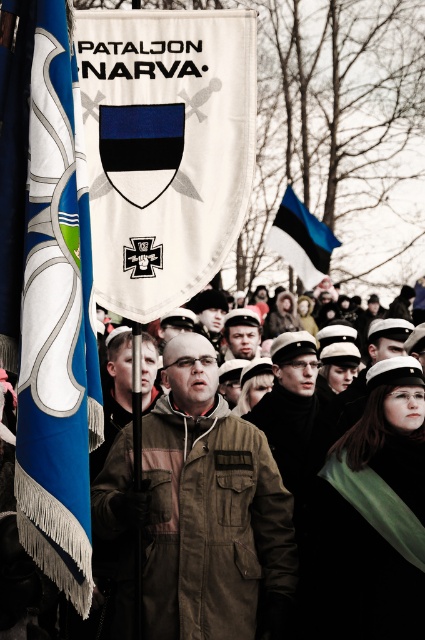
You are standing at the event and want to take a photo of the point at coordinates point (147, 253). If your camera has a maximum focus range of 25 meters, will you be able to focus on it?

The point (147, 253) is 27.66 meters from the viewer, which exceeds the camera maximum focus range of 25 meters. So you won not be able to focus on it.

You are standing at the edge of the crowd watching the ceremony. You need to locate the person holding the flagpole with the banner. Which direction should you look relative to the point marked at coordinates point (201, 509)?

The point (201, 509) corresponds to the brown suede jacket at center, so you should look towards the center to find the person holding the flagpole with the banner.

From the picture: You are a photographer trying to capture a clear photo of the brown suede jacket at center and the blue fringed flag at left. Which object should you focus on first if you want to ensure both are in focus without adjusting your camera settings?

The brown suede jacket at center has a lesser height compared to the blue fringed flag at left, so you should focus on the blue fringed flag at left first since it is taller and will require a closer focus point, ensuring the shorter jacket remains within the depth of field.